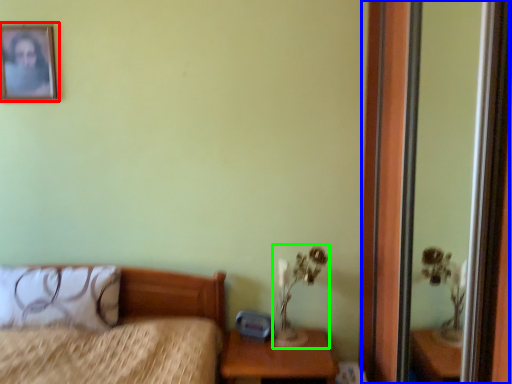
Question: Which is farther away from picture frame (highlighted by a red box)? screen door (highlighted by a blue box) or table lamp (highlighted by a green box)?

Choices:
 (A) screen door
 (B) table lamp

Answer: (A)